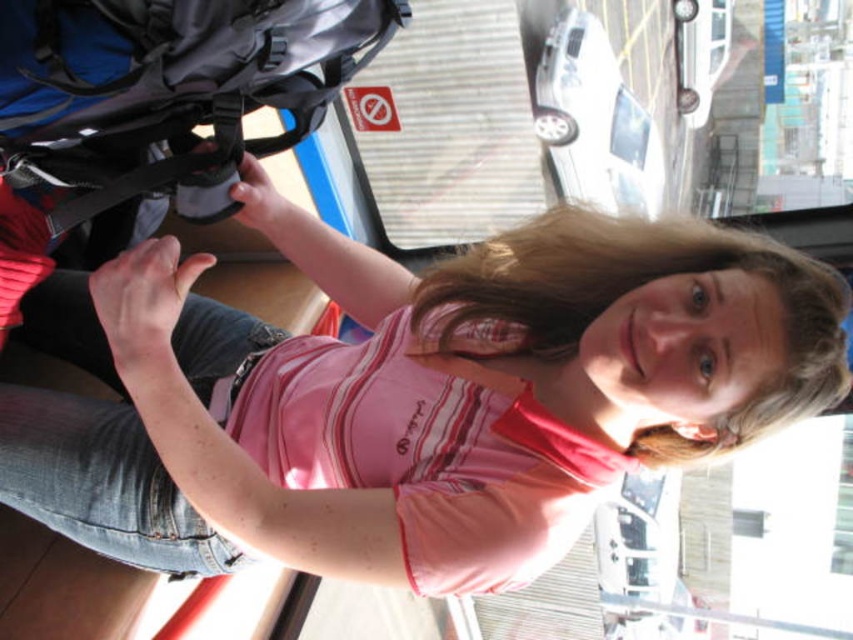
You are a passenger on a bus and need to store your matte black backpack at left. There is a luggage compartment above your seat that can only fit items smaller than the pink cotton shirt at center. Can your backpack fit?

Answer: The pink cotton shirt at center is larger in size than the matte black backpack at left. Since the luggage compartment can only fit items smaller than the pink cotton shirt at center, the matte black backpack at left can fit as it is smaller.

You are a fashion designer analyzing the image. You need to determine which item has a greater width between the pink cotton shirt at center and the matte black backpack at left. Which one is wider?

The pink cotton shirt at center has a greater width than the matte black backpack at left according to the description.